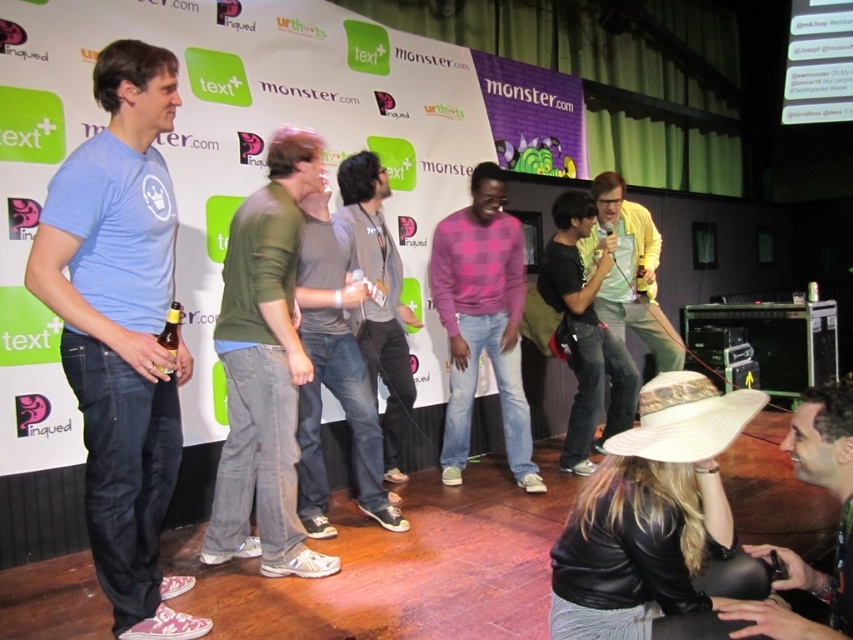
You are a photographer positioned at the front of the stage. You need to take a photo that includes both the leather jacket at lower right and the microphone holder. Can you fit both in your camera frame if your field of view is limited to the bottom half of the stage?

The leather jacket at lower right is located at point (x=838, y=524). Since the photographer is at the front and the field of view is limited to the bottom half of the stage, both the leather jacket at lower right and the microphone holder should be within the frame as they are positioned in the lower section of the stage.

You are a photographer at the event and need to capture a clear shot of both the gray cotton shirt at center and the gold metallic beer at center left. Based on their positions, which object is more likely to block the view of the other?

The gray cotton shirt at center might block the view of the gold metallic beer at center left since it is wider.